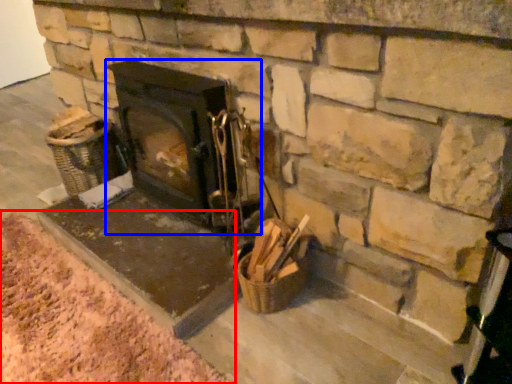
Question: Which object is closer to the camera taking this photo, debris (highlighted by a red box) or wood burning stove (highlighted by a blue box)?

Choices:
 (A) debris
 (B) wood burning stove

Answer: (A)